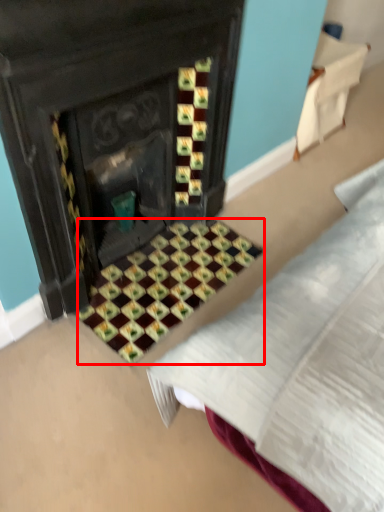
Question: Observing the image, what is the correct spatial positioning of pattern (annotated by the red box) in reference to furniture?

Choices:
 (A) left
 (B) right

Answer: (A)